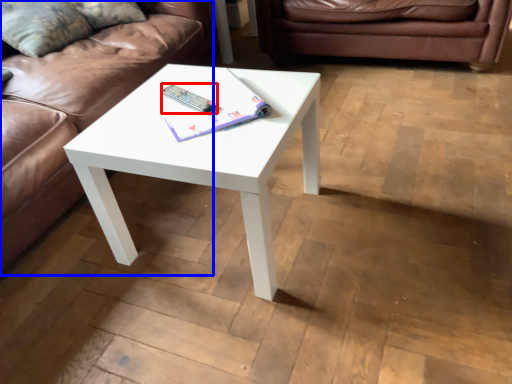
Question: Which object is further to the camera taking this photo, remote (highlighted by a red box) or studio couch (highlighted by a blue box)?

Choices:
 (A) remote
 (B) studio couch

Answer: (A)